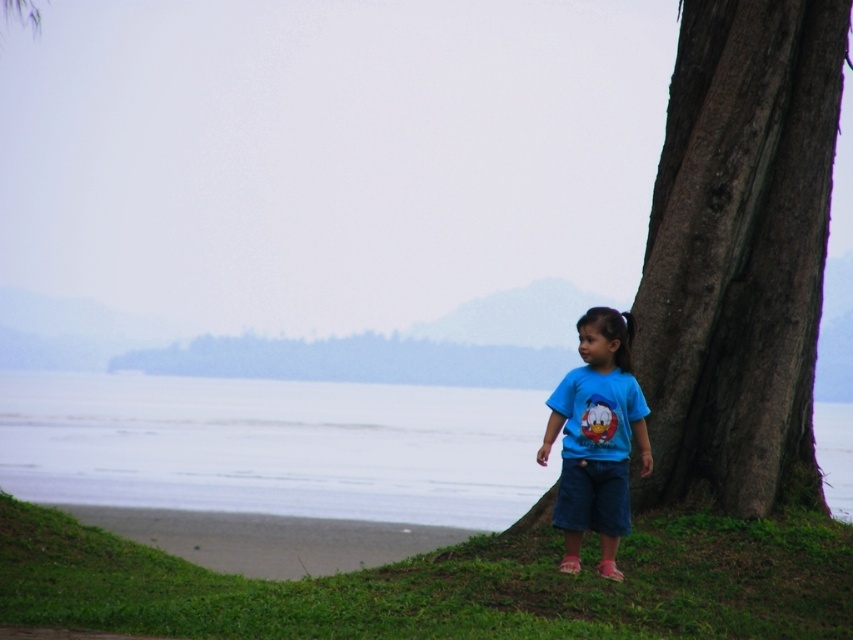
Does smooth water at lower center have a smaller size compared to sandy shore at lower left?

No.

Can you confirm if smooth water at lower center is thinner than sandy shore at lower left?

In fact, smooth water at lower center might be wider than sandy shore at lower left.

Image resolution: width=853 pixels, height=640 pixels. What do you see at coordinates (274, 445) in the screenshot?
I see `smooth water at lower center` at bounding box center [274, 445].

You are a GUI agent. You are given a task and a screenshot of the screen. Output one action in this format:
    pyautogui.click(x=<x>, y=<y>)
    Task: Click on the smooth water at lower center
    The image size is (853, 640).
    Given the screenshot: What is the action you would take?
    pyautogui.click(x=274, y=445)

Does dark brown textured bark at right have a larger size compared to sandy shore at lower left?

Incorrect, dark brown textured bark at right is not larger than sandy shore at lower left.

Who is positioned more to the left, dark brown textured bark at right or sandy shore at lower left?

Positioned to the left is sandy shore at lower left.

The image size is (853, 640). What are the coordinates of `dark brown textured bark at right` in the screenshot? It's located at (740, 253).

Find the location of `dark brown textured bark at right`. dark brown textured bark at right is located at coordinates (740, 253).

Is blue cotton shirt at lower right shorter than sandy shore at lower left?

In fact, blue cotton shirt at lower right may be taller than sandy shore at lower left.

Does blue cotton shirt at lower right come in front of sandy shore at lower left?

Yes, it is in front of sandy shore at lower left.

Is point (550, 435) farther from camera compared to point (358, 554)?

No, (550, 435) is in front of (358, 554).

Where is `blue cotton shirt at lower right`? The image size is (853, 640). blue cotton shirt at lower right is located at coordinates (596, 438).